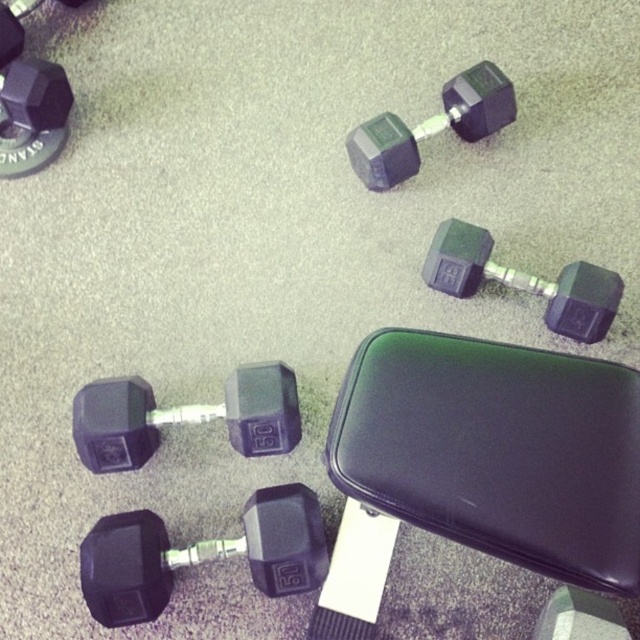
Can you confirm if rubberized black dumbbell at lower center is positioned to the right of matte black dumbbell at center right?

No, rubberized black dumbbell at lower center is not to the right of matte black dumbbell at center right.

Identify the location of rubberized black dumbbell at lower center. The image size is (640, 640). (184, 417).

Between rubberized black dumbbell at lower left and matte black dumbbell at center right, which one appears on the left side from the viewer's perspective?

Positioned to the left is rubberized black dumbbell at lower left.

Does rubberized black dumbbell at lower left appear over matte black dumbbell at center right?

Actually, rubberized black dumbbell at lower left is below matte black dumbbell at center right.

Is point (282, 529) less distant than point (568, 282)?

That is True.

Where is `rubberized black dumbbell at lower left`? This screenshot has width=640, height=640. rubberized black dumbbell at lower left is located at coordinates (200, 554).

Is rubberized black dumbbell at upper center behind matte black dumbbell at upper left?

Yes, it is behind matte black dumbbell at upper left.

Between point (362, 132) and point (0, 140), which one is positioned in front?

Positioned in front is point (0, 140).

You are a GUI agent. You are given a task and a screenshot of the screen. Output one action in this format:
    pyautogui.click(x=<x>, y=<y>)
    Task: Click on the rubberized black dumbbell at upper center
    Image resolution: width=640 pixels, height=640 pixels.
    Given the screenshot: What is the action you would take?
    pyautogui.click(x=432, y=125)